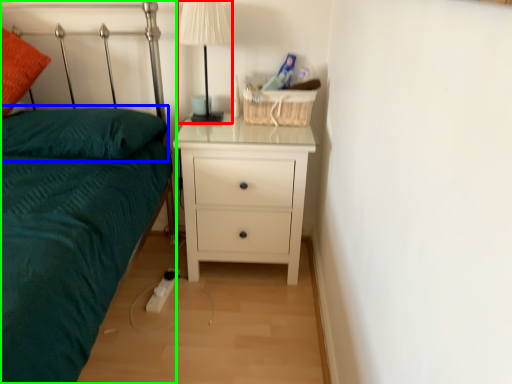
Question: Based on their relative distances, which object is farther from table lamp (highlighted by a red box)? Choose from pillow (highlighted by a blue box) and bed (highlighted by a green box).

Choices:
 (A) pillow
 (B) bed

Answer: (B)